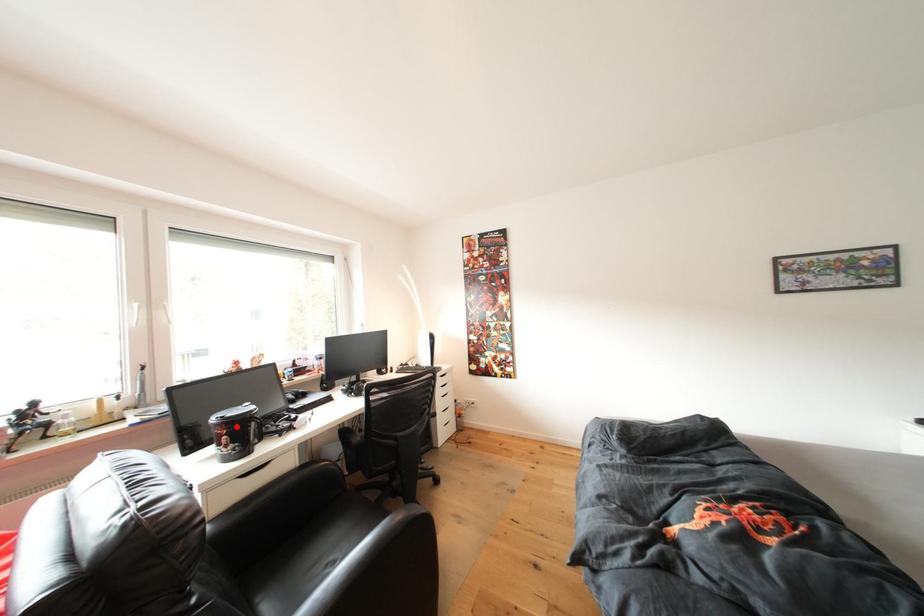
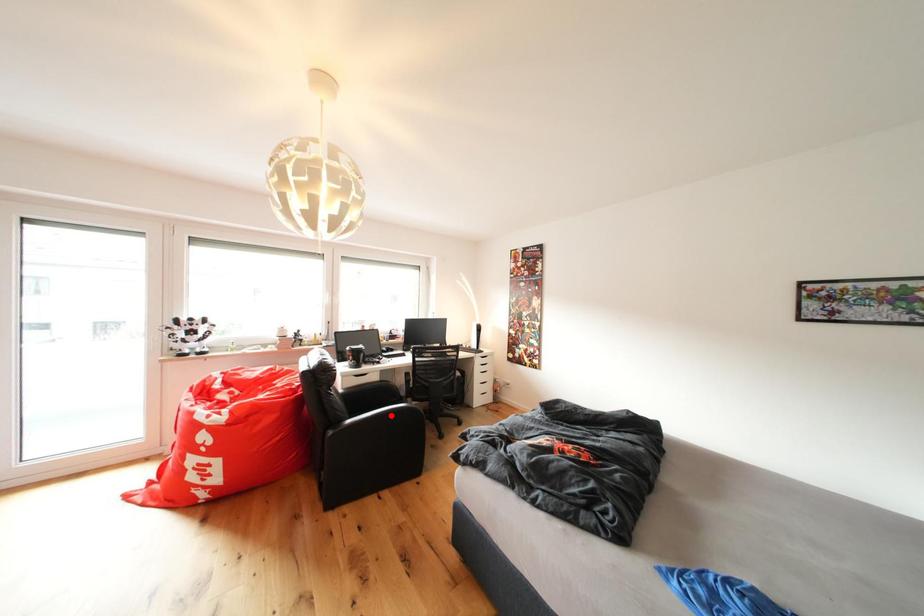
I am providing you with two images of the same scene from different viewpoints. A red point is marked on the first image and another point is marked on the second image. Are the points marked in image1 and image2 representing the same 3D position?

No